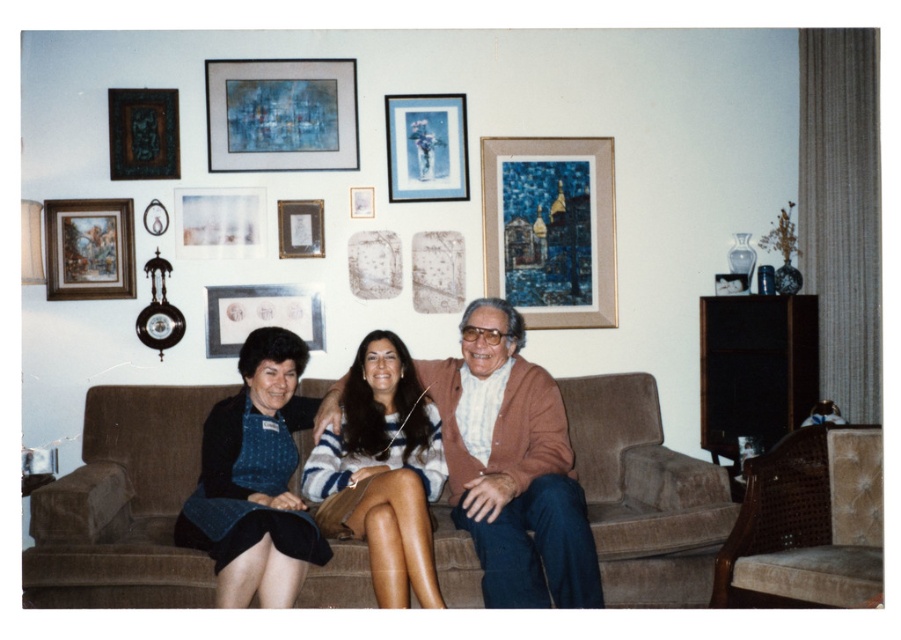
Question: Does striped sweater at center lie behind matte gold picture frame at center?

Choices:
 (A) no
 (B) yes

Answer: (A)

Question: Among these objects, which one is nearest to the camera?

Choices:
 (A) velvet brown armchair at lower right
 (B) blue textured painting at upper center

Answer: (A)

Question: Is brown suede couch at center behind blue textured painting at upper center?

Choices:
 (A) no
 (B) yes

Answer: (A)

Question: Which of the following is the closest to the observer?

Choices:
 (A) (171, 131)
 (B) (132, 252)

Answer: (B)

Question: Which object is the farthest from the matte gold picture frame at center?

Choices:
 (A) brown wool sweater at center
 (B) matte brown picture frame at upper center
 (C) velvet brown armchair at lower right

Answer: (C)

Question: In this image, where is matte gold picture frame at center located relative to matte white picture frame at upper left?

Choices:
 (A) right
 (B) left

Answer: (A)